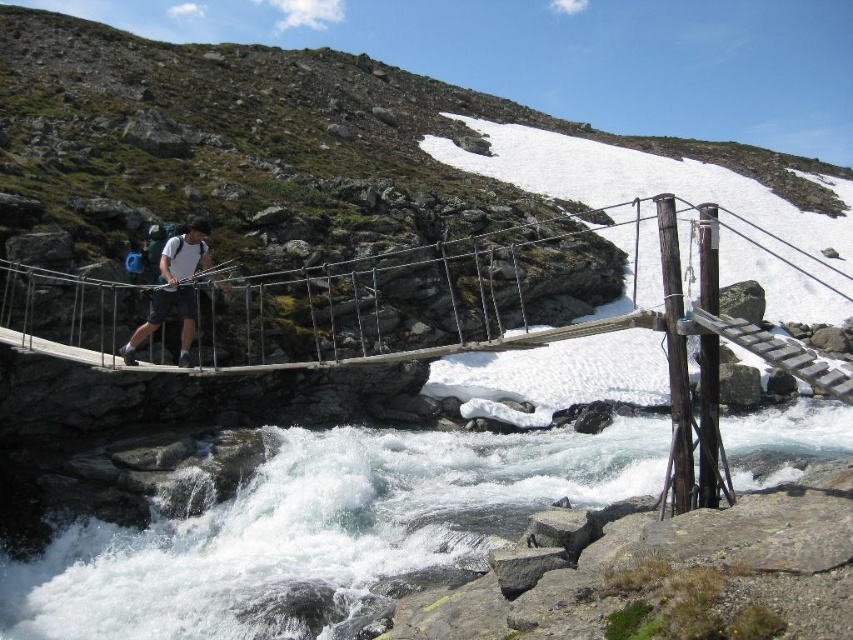
Question: Can you confirm if white frothy water at lower center is positioned above matte white shirt at center?

Choices:
 (A) no
 (B) yes

Answer: (A)

Question: Which point is closer to the camera taking this photo?

Choices:
 (A) (349, 577)
 (B) (187, 262)

Answer: (A)

Question: Which object appears farthest from the camera in this image?

Choices:
 (A) wooden suspension bridge at center
 (B) white frothy water at lower center
 (C) matte white shirt at center

Answer: (C)

Question: Can you confirm if white frothy water at lower center is thinner than wooden suspension bridge at center?

Choices:
 (A) yes
 (B) no

Answer: (A)

Question: Which of the following is the closest to the observer?

Choices:
 (A) (195, 260)
 (B) (122, 620)
 (C) (437, 253)

Answer: (B)

Question: Does white frothy water at lower center appear on the right side of matte white shirt at center?

Choices:
 (A) yes
 (B) no

Answer: (A)